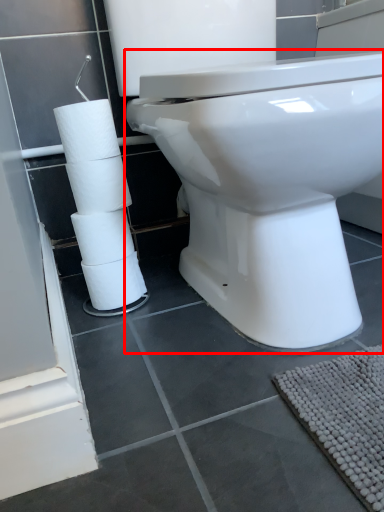
Question: From the image's perspective, considering the relative positions of toilet (annotated by the red box) and toilet paper in the image provided, where is toilet (annotated by the red box) located with respect to the staircase?

Choices:
 (A) above
 (B) below

Answer: (A)